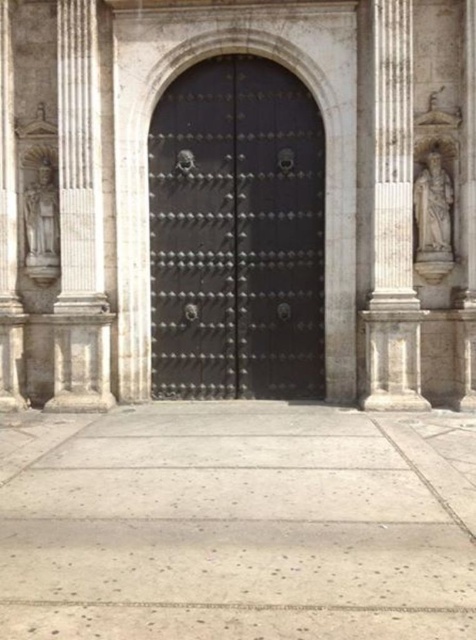
You are a visitor approaching the entrance of the historical building. You want to take a photo of the polished stone statue at left without the polished metal door at center blocking the view. Is the statue visible from your current position in front of the door?

The polished stone statue at left is behind the polished metal door at center, so it is not visible from in front of the door. Move to a position where you can see around or behind the door to capture the statue without obstruction.